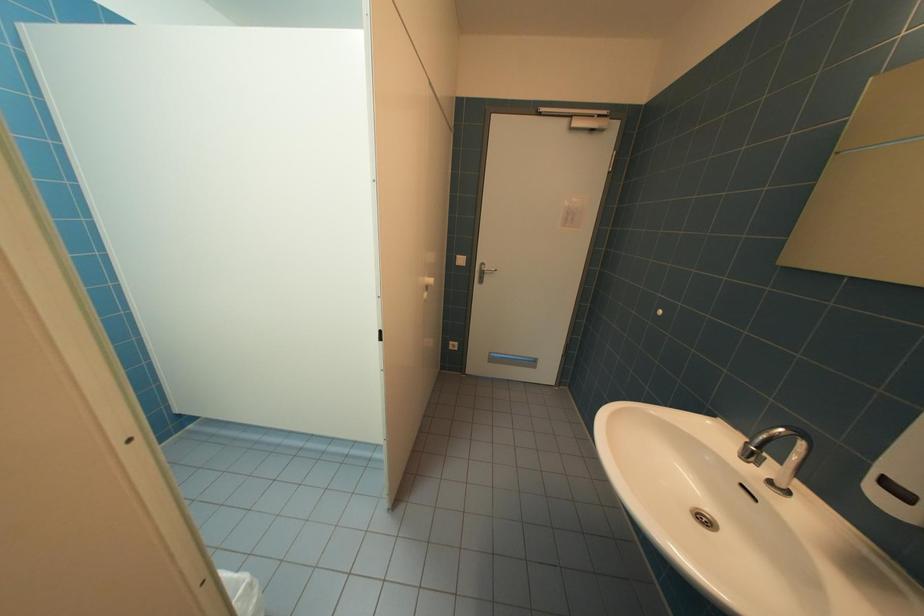
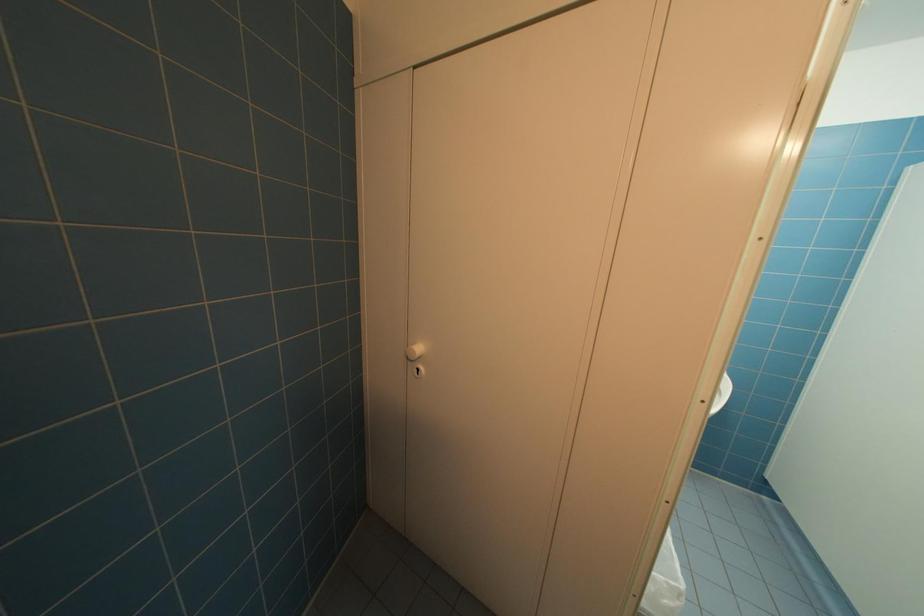
The images are taken continuously from a first-person perspective. In which direction is your viewpoint rotating?

The camera's rotation is toward left-down.